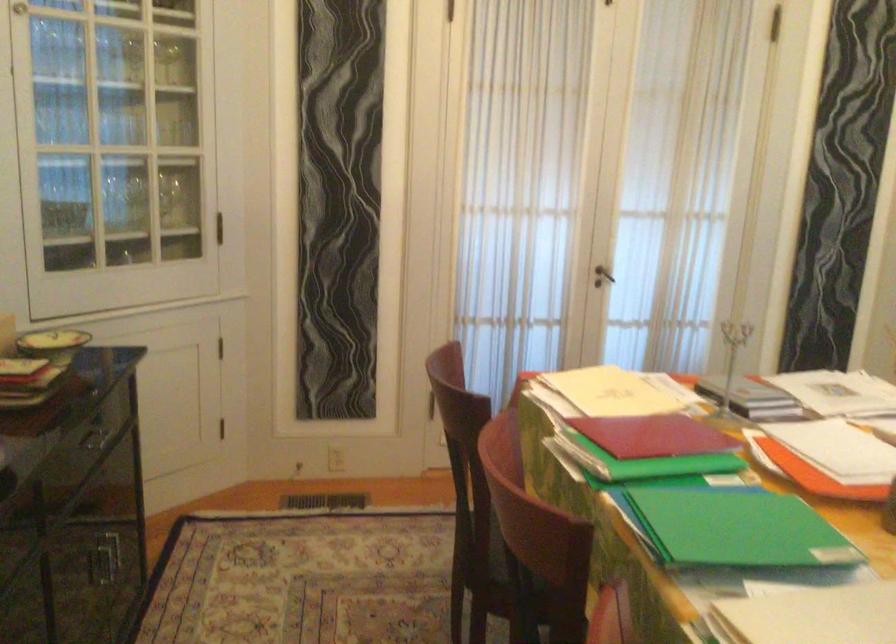
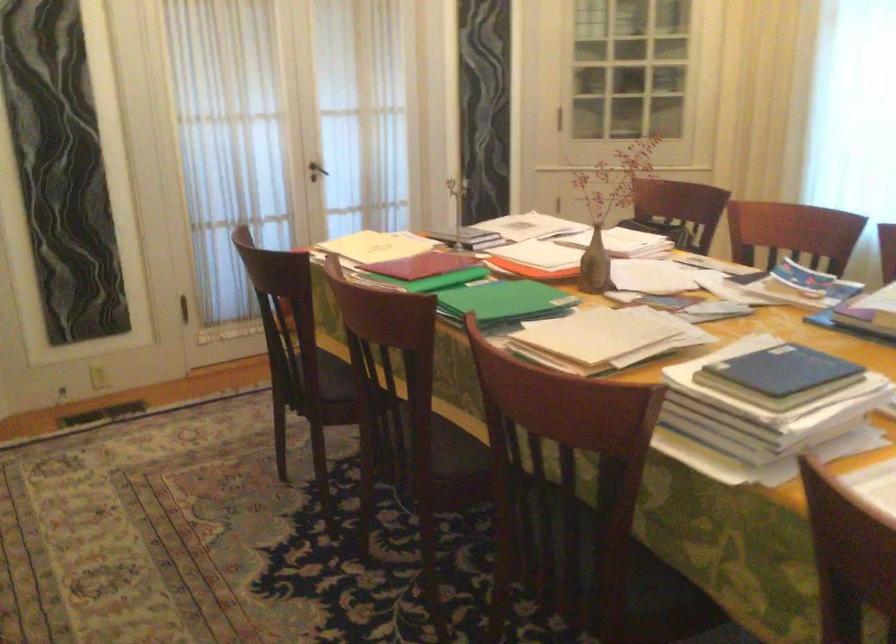
Question: The camera is either moving clockwise (left) or counter-clockwise (right) around the object. The first image is from the beginning of the video and the second image is from the end. Is the camera moving left or right when shooting the video?

Choices:
 (A) Left
 (B) Right

Answer: (A)